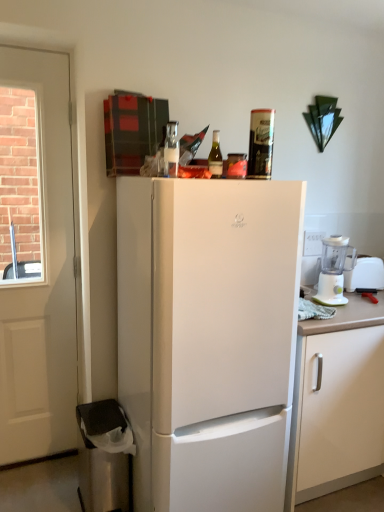
Question: From the image's perspective, is white wooden door at left located beneath clear glass bottle at upper center, which is the second bottle in right-to-left order?

Choices:
 (A) no
 (B) yes

Answer: (B)

Question: Considering the relative sizes of white wooden door at left and clear glass bottle at upper center, which is the second bottle in right-to-left order, in the image provided, is white wooden door at left thinner than clear glass bottle at upper center, which is the second bottle in right-to-left order,?

Choices:
 (A) yes
 (B) no

Answer: (B)

Question: From a real-world perspective, is white wooden door at left physically below clear glass bottle at upper center, the first bottle in the left-to-right sequence?

Choices:
 (A) no
 (B) yes

Answer: (B)

Question: Is the depth of white wooden door at left less than that of clear glass bottle at upper center, the first bottle in the left-to-right sequence?

Choices:
 (A) no
 (B) yes

Answer: (A)

Question: Is white wooden door at left facing towards clear glass bottle at upper center, which is the second bottle in right-to-left order?

Choices:
 (A) yes
 (B) no

Answer: (B)

Question: Can you confirm if white wooden door at left is bigger than clear glass bottle at upper center, the first bottle in the left-to-right sequence?

Choices:
 (A) yes
 (B) no

Answer: (A)

Question: Is clear glass bottle at upper center, which is the second bottle in right-to-left order, smaller than white plastic blender at right?

Choices:
 (A) yes
 (B) no

Answer: (A)

Question: Can you confirm if clear glass bottle at upper center, which is the second bottle in right-to-left order, is thinner than white plastic blender at right?

Choices:
 (A) no
 (B) yes

Answer: (B)

Question: Is clear glass bottle at upper center, which is the second bottle in right-to-left order, wider than white plastic blender at right?

Choices:
 (A) no
 (B) yes

Answer: (A)

Question: Could you tell me if clear glass bottle at upper center, which is the second bottle in right-to-left order, is facing white plastic blender at right?

Choices:
 (A) no
 (B) yes

Answer: (A)

Question: Can you confirm if clear glass bottle at upper center, which is the second bottle in right-to-left order, is positioned to the right of white plastic blender at right?

Choices:
 (A) yes
 (B) no

Answer: (B)

Question: From the image's perspective, is clear glass bottle at upper center, the first bottle in the left-to-right sequence, beneath white plastic blender at right?

Choices:
 (A) no
 (B) yes

Answer: (A)

Question: Does green glass bottle at top, which appears as the first bottle when viewed from the right, contain clear glass bottle at upper center, which is the second bottle in right-to-left order?

Choices:
 (A) yes
 (B) no

Answer: (B)